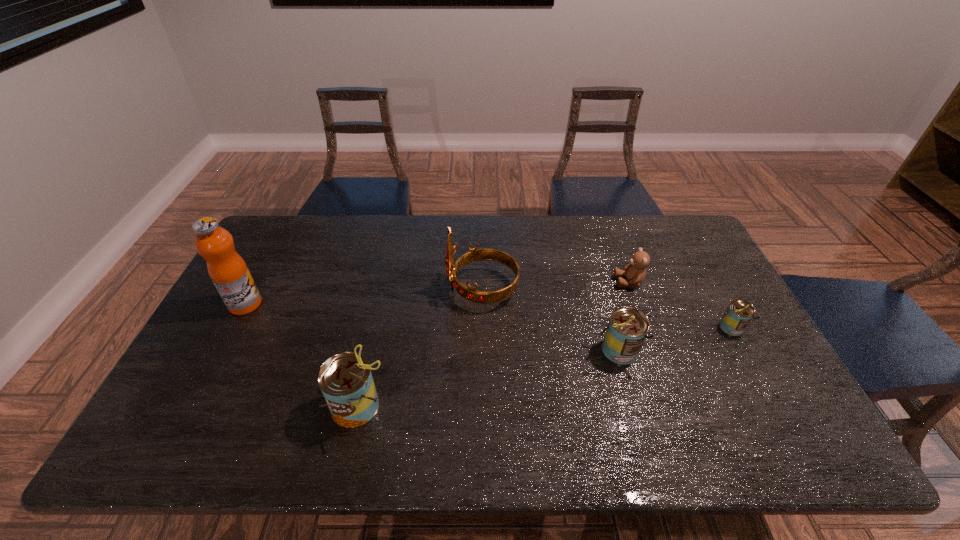
Identify the location of free spot located 0.200m on the left of the nearest object. (242, 406).

At what (x,y) coordinates should I click in order to perform the action: click on vacant region located 0.150m on the back of the third shortest object. Please return your answer as a coordinate pair (x, y). Looking at the image, I should click on (603, 296).

Where is `free space located 0.200m on the back of the rightmost can`? This screenshot has width=960, height=540. free space located 0.200m on the back of the rightmost can is located at coordinates [700, 272].

This screenshot has height=540, width=960. In order to click on vacant region located on the front-facing side of the third object from left to right in this screenshot , I will do `click(359, 289)`.

Identify the location of free location located 0.070m on the front-facing side of the third object from left to right. (423, 289).

Where is `free space located on the front-facing side of the third object from left to right`? The height and width of the screenshot is (540, 960). free space located on the front-facing side of the third object from left to right is located at coordinates (427, 289).

Find the location of a particular element. The height and width of the screenshot is (540, 960). vacant point located on the right of the fruit juice is located at coordinates (381, 304).

Find the location of a particular element. This screenshot has width=960, height=540. vacant region located 0.210m on the face of the teddy bear is located at coordinates (548, 282).

Where is `free space located on the face of the teddy bear`? free space located on the face of the teddy bear is located at coordinates (519, 282).

The image size is (960, 540). Identify the location of vacant region located on the face of the teddy bear. (567, 282).